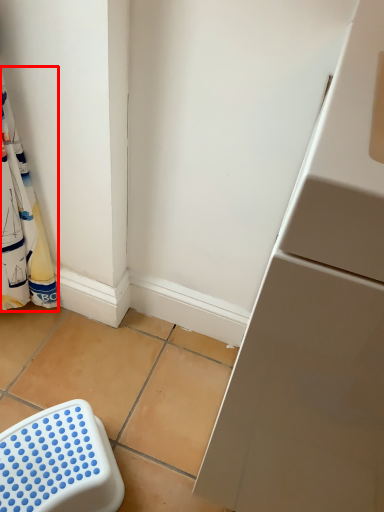
Question: From the image's perspective, what is the correct spatial positioning of laundry (annotated by the red box) in reference to furniture?

Choices:
 (A) above
 (B) below

Answer: (A)